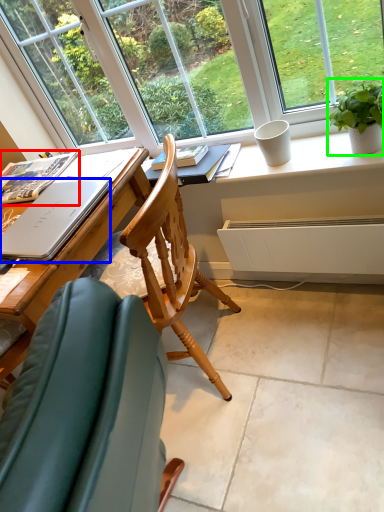
Question: Considering the real-world distances, which object is closest to book (highlighted by a red box)? laptop (highlighted by a blue box) or houseplant (highlighted by a green box).

Choices:
 (A) laptop
 (B) houseplant

Answer: (A)